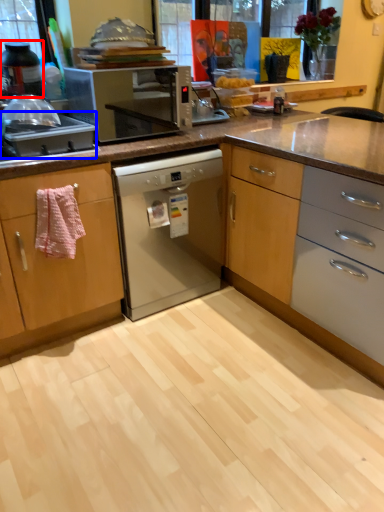
Question: Which of the following is the farthest to the observer, kitchen appliance (highlighted by a red box) or kitchen appliance (highlighted by a blue box)?

Choices:
 (A) kitchen appliance
 (B) kitchen appliance

Answer: (A)